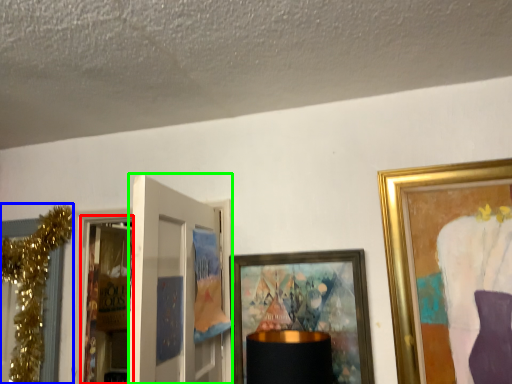
Question: Which object is the farthest from screen door (highlighted by a red box)? Choose among these: christmas decoration (highlighted by a blue box) or door (highlighted by a green box).

Choices:
 (A) christmas decoration
 (B) door

Answer: (B)